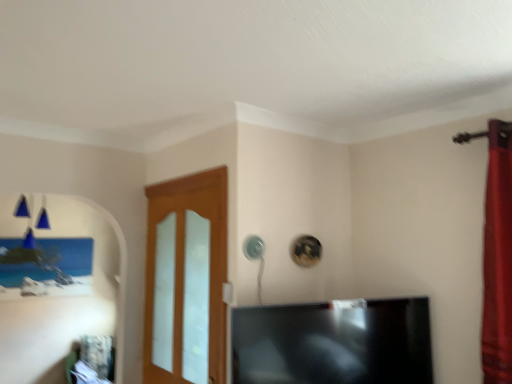
Locate an element on the screen. This screenshot has width=512, height=384. light wood/glass door at center is located at coordinates (186, 279).

This screenshot has width=512, height=384. What do you see at coordinates (186, 279) in the screenshot? I see `light wood/glass door at center` at bounding box center [186, 279].

The width and height of the screenshot is (512, 384). What are the coordinates of `black glossy tv at center` in the screenshot? It's located at (333, 343).

Consider the image. What is the approximate width of black glossy tv at center?

The width of black glossy tv at center is 7.23 inches.

What do you see at coordinates (333, 343) in the screenshot? This screenshot has height=384, width=512. I see `black glossy tv at center` at bounding box center [333, 343].

Locate an element on the screen. light wood/glass door at center is located at coordinates (186, 279).

Is light wood/glass door at center to the right of black glossy tv at center from the viewer's perspective?

Incorrect, light wood/glass door at center is not on the right side of black glossy tv at center.

Does light wood/glass door at center come behind black glossy tv at center?

That is True.

Considering the points (155, 217) and (330, 368), which point is in front, point (155, 217) or point (330, 368)?

The point (330, 368) is more forward.

From the image's perspective, which is above, light wood/glass door at center or black glossy tv at center?

light wood/glass door at center appears higher in the image.

From a real-world perspective, is light wood/glass door at center on top of black glossy tv at center?

Yes, from a real-world perspective, light wood/glass door at center is on top of black glossy tv at center.

Looking at this image, which object is thinner, light wood/glass door at center or black glossy tv at center?

With smaller width is light wood/glass door at center.

Which of these two, light wood/glass door at center or black glossy tv at center, stands taller?

With more height is light wood/glass door at center.

Looking at the image, does light wood/glass door at center seem bigger or smaller compared to black glossy tv at center?

Considering their sizes, light wood/glass door at center takes up less space than black glossy tv at center.

Looking at this image, which is correct: light wood/glass door at center is inside black glossy tv at center, or outside of it?

light wood/glass door at center is not inside black glossy tv at center, it's outside.

Is there a large distance between light wood/glass door at center and black glossy tv at center?

No, light wood/glass door at center is not far from black glossy tv at center.

Is black glossy tv at center at the back of light wood/glass door at center?

light wood/glass door at center is not turned away from black glossy tv at center.

How different are the orientations of light wood/glass door at center and black glossy tv at center in degrees?

They differ by 74.7 degrees in their facing directions.

How far apart are light wood/glass door at center and black glossy tv at center?

The distance of light wood/glass door at center from black glossy tv at center is 67.21 centimeters.

Where is `door above the black glossy tv at center (from the image's perspective)`? Image resolution: width=512 pixels, height=384 pixels. door above the black glossy tv at center (from the image's perspective) is located at coordinates (186, 279).

Considering the relative positions of black glossy tv at center and light wood/glass door at center in the image provided, is black glossy tv at center to the left or to the right of light wood/glass door at center?

black glossy tv at center is positioned on light wood/glass door at center's right side.

Is the depth of black glossy tv at center greater than that of light wood/glass door at center?

No, black glossy tv at center is in front of light wood/glass door at center.

Which is more distant, (356, 322) or (147, 239)?

Positioned behind is point (147, 239).

From the image's perspective, relative to light wood/glass door at center, is black glossy tv at center above or below?

Clearly, from the image's perspective, black glossy tv at center is below light wood/glass door at center.

From a real-world perspective, is black glossy tv at center positioned under light wood/glass door at center based on gravity?

Yes.

Considering the relative sizes of black glossy tv at center and light wood/glass door at center in the image provided, is black glossy tv at center thinner than light wood/glass door at center?

In fact, black glossy tv at center might be wider than light wood/glass door at center.

Who is taller, black glossy tv at center or light wood/glass door at center?

light wood/glass door at center is taller.

Consider the image. Does black glossy tv at center have a larger size compared to light wood/glass door at center?

Indeed, black glossy tv at center has a larger size compared to light wood/glass door at center.

Would you say black glossy tv at center is outside light wood/glass door at center?

black glossy tv at center lies outside light wood/glass door at center's area.

Is black glossy tv at center next to light wood/glass door at center and touching it?

They are not placed beside each other.

Is black glossy tv at center turned away from light wood/glass door at center?

Yes, black glossy tv at center is facing away from light wood/glass door at center.

In the scene shown: What's the angular difference between black glossy tv at center and light wood/glass door at center's facing directions?

The angular difference between black glossy tv at center and light wood/glass door at center is 74.7 degrees.

Locate an element on the screen. television located below the light wood/glass door at center (from the image's perspective) is located at coordinates (333, 343).

Where is `television lying below the light wood/glass door at center (from the image's perspective)`? television lying below the light wood/glass door at center (from the image's perspective) is located at coordinates (333, 343).

Identify the location of television lying on the right of light wood/glass door at center. point(333,343).